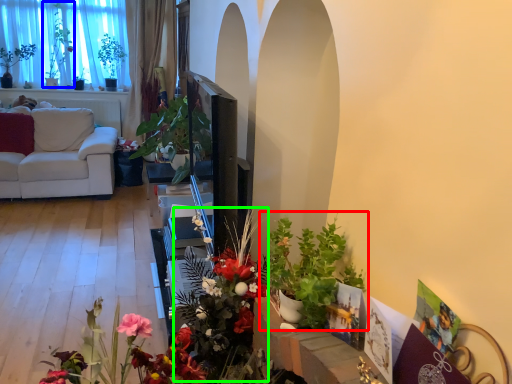
Question: Based on their relative distances, which object is nearer to houseplant (highlighted by a red box)? Choose from bouquet (highlighted by a blue box) and floral arrangement (highlighted by a green box).

Choices:
 (A) bouquet
 (B) floral arrangement

Answer: (B)